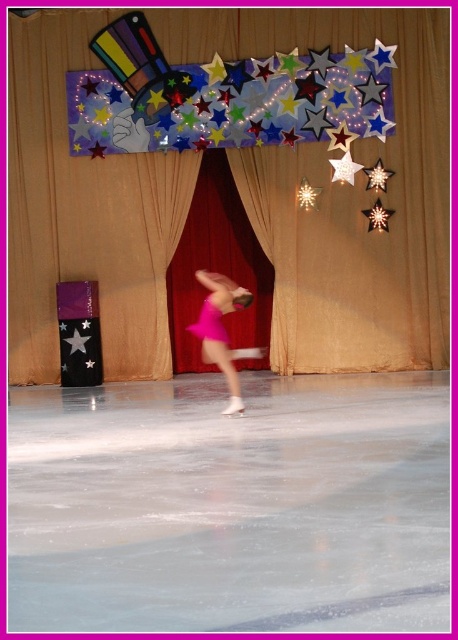
You are a photographer standing at the edge of the white ice skating rink at center and want to capture a closeup shot of the pink satin skirt at center. Your camera has a minimum focusing distance of 2 meters. Can you take the photo without moving closer?

The white ice skating rink at center is 2.35 meters away from the pink satin skirt at center. Since the minimum focusing distance is 2 meters, the photographer can take the photo without moving closer because the distance is within the camera range.

You are a photographer standing at the edge of the ice rink. You want to capture a closeup shot of the pink satin skirt at center. Considering your current position, can you estimate how far you need to move forward to get within 5 meters of the skirt?

The pink satin skirt at center is currently 8.19 meters away from you. To get within 5 meters, you need to move forward approximately 3.19 meters.